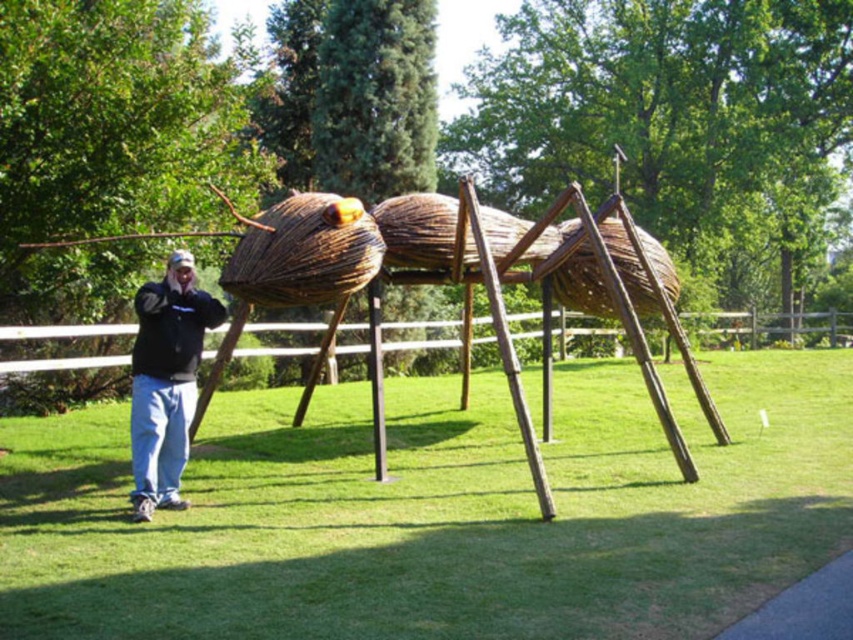
Question: Among these objects, which one is farthest from the camera?

Choices:
 (A) green grass at center
 (B) black fleece jacket at lower left

Answer: (B)

Question: Is green grass at center bigger than black fleece jacket at lower left?

Choices:
 (A) no
 (B) yes

Answer: (B)

Question: Is green grass at center to the right of black fleece jacket at lower left from the viewer's perspective?

Choices:
 (A) yes
 (B) no

Answer: (A)

Question: Does green grass at center have a smaller size compared to black fleece jacket at lower left?

Choices:
 (A) no
 (B) yes

Answer: (A)